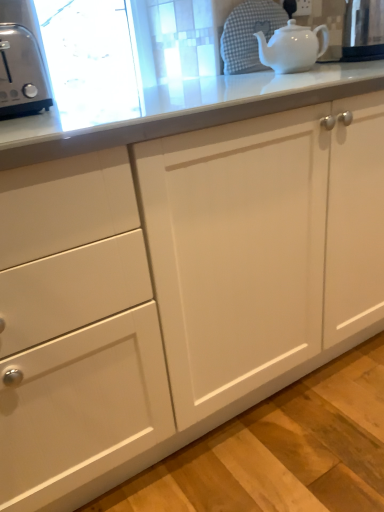
Question: Is satin silver toaster at left aimed at metallic stainless steel kettle at upper right?

Choices:
 (A) yes
 (B) no

Answer: (B)

Question: Is satin silver toaster at left closer to camera compared to metallic stainless steel kettle at upper right?

Choices:
 (A) yes
 (B) no

Answer: (A)

Question: Is satin silver toaster at left bigger than metallic stainless steel kettle at upper right?

Choices:
 (A) yes
 (B) no

Answer: (A)

Question: Is satin silver toaster at left positioned with its back to metallic stainless steel kettle at upper right?

Choices:
 (A) no
 (B) yes

Answer: (A)

Question: From a real-world perspective, is satin silver toaster at left located beneath metallic stainless steel kettle at upper right?

Choices:
 (A) yes
 (B) no

Answer: (A)

Question: Does satin silver toaster at left have a smaller size compared to metallic stainless steel kettle at upper right?

Choices:
 (A) no
 (B) yes

Answer: (A)

Question: Is white glossy teapot at upper right shorter than metallic stainless steel kettle at upper right?

Choices:
 (A) yes
 (B) no

Answer: (A)

Question: Could you tell me if white glossy teapot at upper right is facing metallic stainless steel kettle at upper right?

Choices:
 (A) no
 (B) yes

Answer: (A)

Question: Can you confirm if white glossy teapot at upper right is taller than metallic stainless steel kettle at upper right?

Choices:
 (A) no
 (B) yes

Answer: (A)

Question: Can you confirm if white glossy teapot at upper right is positioned to the left of metallic stainless steel kettle at upper right?

Choices:
 (A) yes
 (B) no

Answer: (A)

Question: Does white glossy teapot at upper right lie behind metallic stainless steel kettle at upper right?

Choices:
 (A) no
 (B) yes

Answer: (A)

Question: Is white glossy teapot at upper right smaller than metallic stainless steel kettle at upper right?

Choices:
 (A) yes
 (B) no

Answer: (A)

Question: Does satin silver toaster at left have a lesser width compared to white glossy teapot at upper right?

Choices:
 (A) no
 (B) yes

Answer: (A)